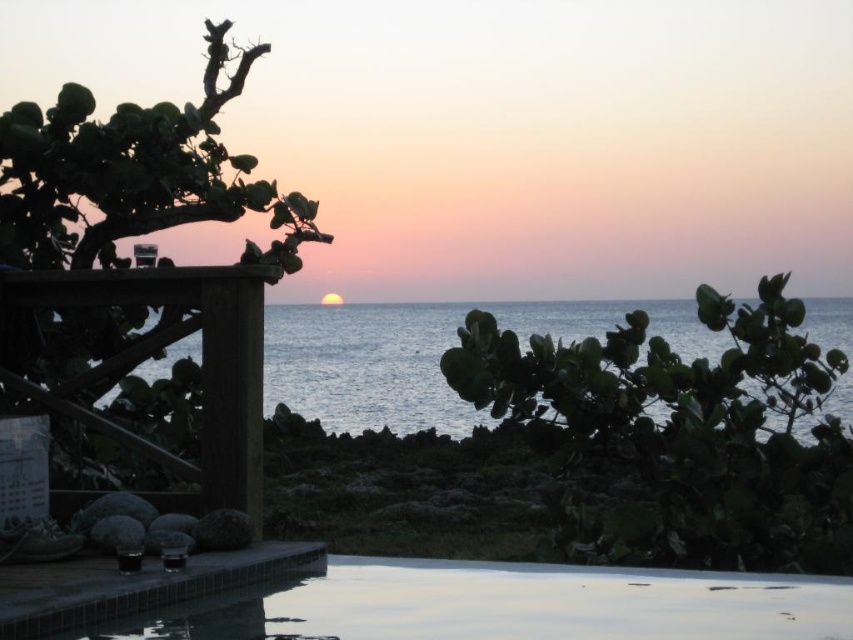
Question: Does blue water at center appear on the left side of wooden rail at left?

Choices:
 (A) no
 (B) yes

Answer: (A)

Question: Can you confirm if smooth concrete pool at center is bigger than wooden rail at left?

Choices:
 (A) yes
 (B) no

Answer: (A)

Question: Which object is farther from the camera taking this photo?

Choices:
 (A) blue water at center
 (B) wooden rail at left
 (C) smooth concrete pool at center

Answer: (A)

Question: Can you confirm if smooth concrete pool at center is positioned below wooden rail at left?

Choices:
 (A) no
 (B) yes

Answer: (B)

Question: Which point is closer to the camera?

Choices:
 (A) (318, 381)
 (B) (549, 580)

Answer: (B)

Question: Among these objects, which one is farthest from the camera?

Choices:
 (A) smooth concrete pool at center
 (B) wooden rail at left
 (C) blue water at center

Answer: (C)